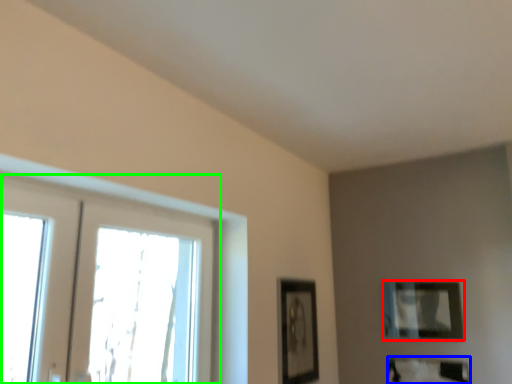
Question: Which is nearer to the picture frame (highlighted by a red box)? picture frame (highlighted by a blue box) or window (highlighted by a green box).

Choices:
 (A) picture frame
 (B) window

Answer: (A)